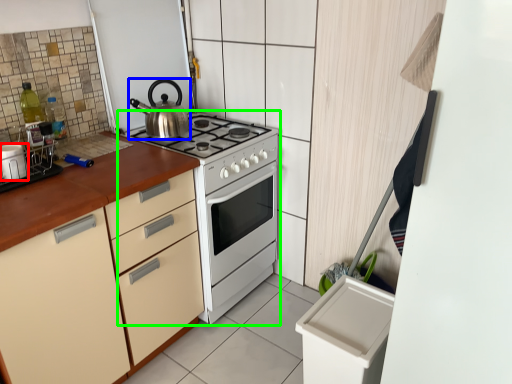
Question: Which is nearer to the kitchen appliance (highlighted by a red box)? kettle (highlighted by a blue box) or appliance (highlighted by a green box).

Choices:
 (A) kettle
 (B) appliance

Answer: (A)